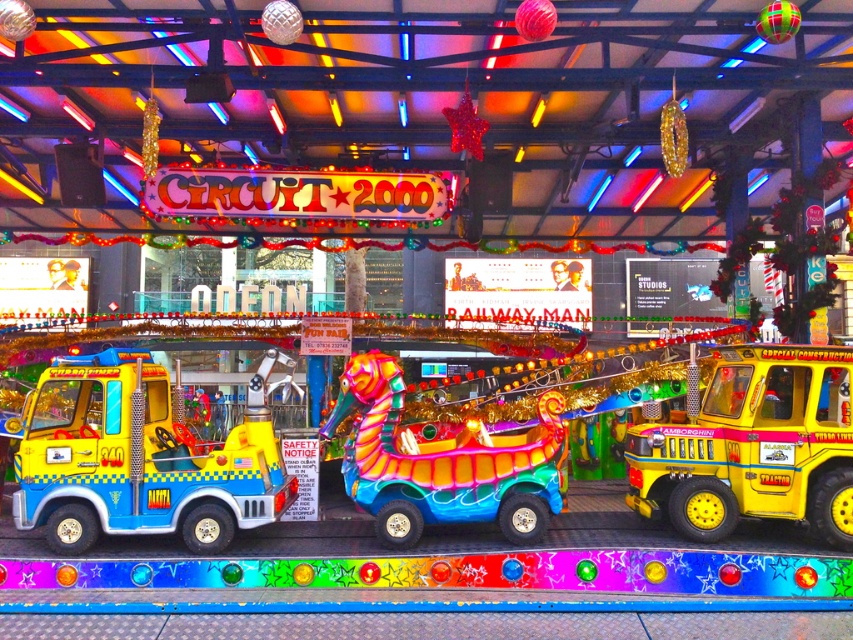
From the picture: You are standing at the camera position in the fairground scene. There is a point marked at coordinates point (21, 499). Can you reach this point by walking forward without turning? Explain your reasoning based on the distance provided.

The point (21, 499) is 27.57 feet away from the camera. Since this distance is measurable and the path is presumably clear in the fairground scene, you could walk forward towards it. However, the actual feasibility depends on any obstacles not mentioned in the description. Based solely on distance, yes, you can reach it by walking forward 27.57 feet.

You are standing at the entrance of the fairground attraction and see the yellow matte tow truck at left and the yellow matte construction vehicle at right. Which vehicle is closer to you?

The yellow matte tow truck at left is closer to you because the yellow matte construction vehicle at right is behind it.

You are a visitor at the fairground and notice two yellow vehicles near the entrance. The yellow matte tow truck at left and the yellow matte construction vehicle at right. According to the scene, which one is placed higher up?

The yellow matte tow truck at left is positioned over the yellow matte construction vehicle at right, so it is placed higher up.